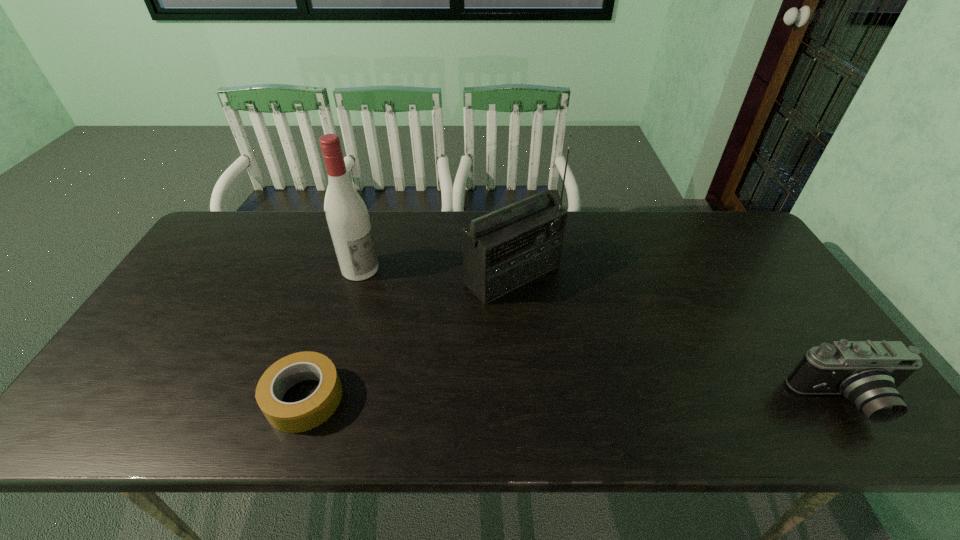
At what (x,y) coordinates should I click in order to perform the action: click on vacant area that lies between the shortest object and the rightmost object. Please return your answer as a coordinate pair (x, y). Looking at the image, I should click on (575, 400).

Locate an element on the screen. vacant space in between the radio receiver and the alcohol is located at coordinates (437, 272).

Where is `vacant space that is in between the rightmost object and the duct tape`? vacant space that is in between the rightmost object and the duct tape is located at coordinates (575, 400).

Identify the location of free space between the rightmost object and the second object from right to left. (681, 339).

At what (x,y) coordinates should I click in order to perform the action: click on vacant area that lies between the alcohol and the camera. Please return your answer as a coordinate pair (x, y). This screenshot has height=540, width=960. Looking at the image, I should click on (604, 335).

At what (x,y) coordinates should I click in order to perform the action: click on object that stands as the second closest to the third object from left to right. Please return your answer as a coordinate pair (x, y). This screenshot has height=540, width=960. Looking at the image, I should click on (304, 415).

This screenshot has height=540, width=960. In order to click on object that can be found as the third closest to the radio receiver in this screenshot , I will do `click(867, 373)`.